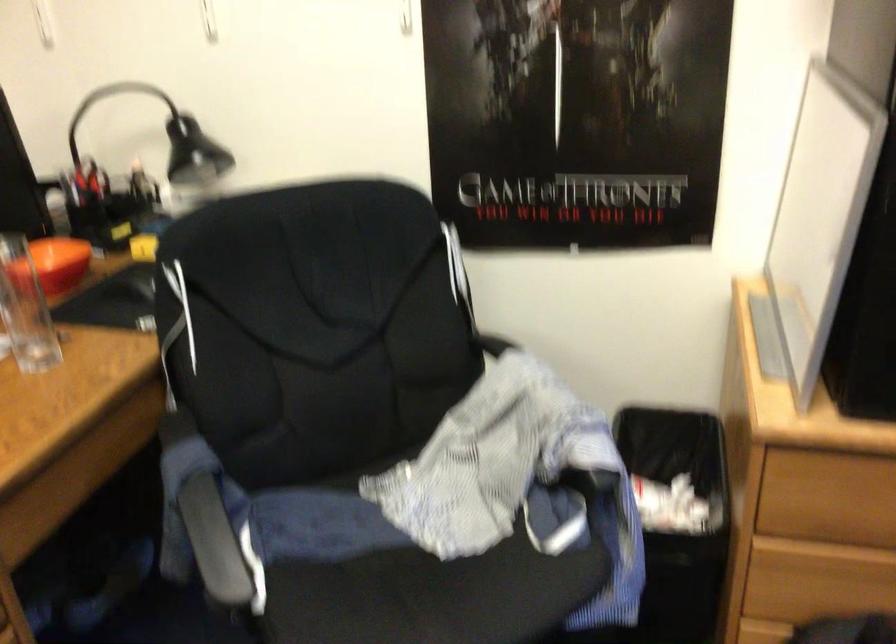
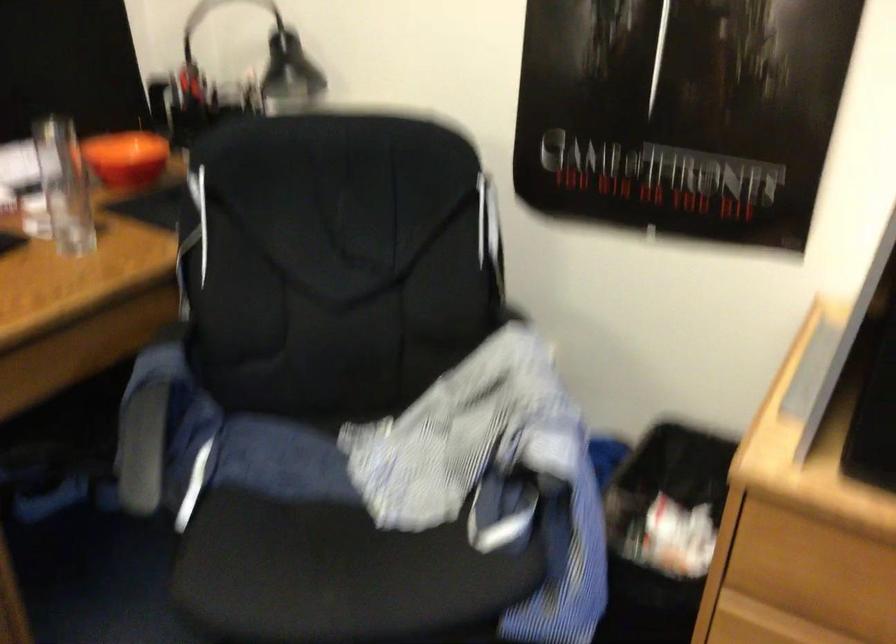
Where in the second image is the point corresponding to [648,509] from the first image?

(659, 529)